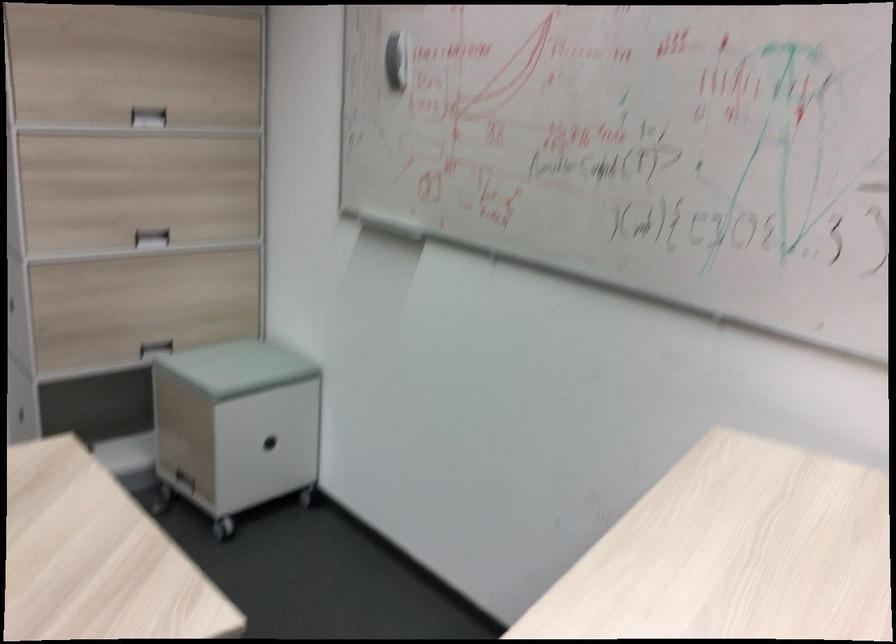
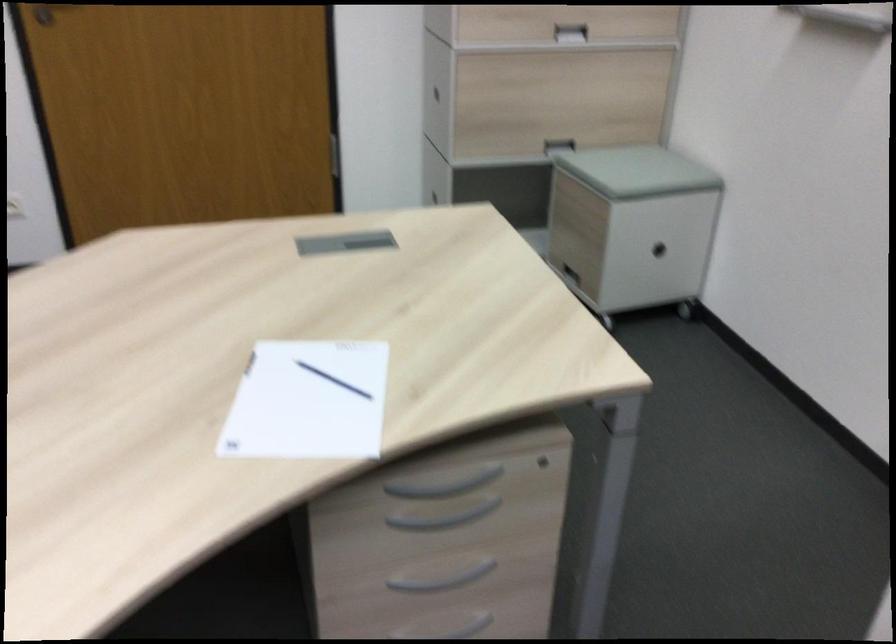
Locate, in the second image, the point that corresponds to point (153, 243) in the first image.

(570, 33)